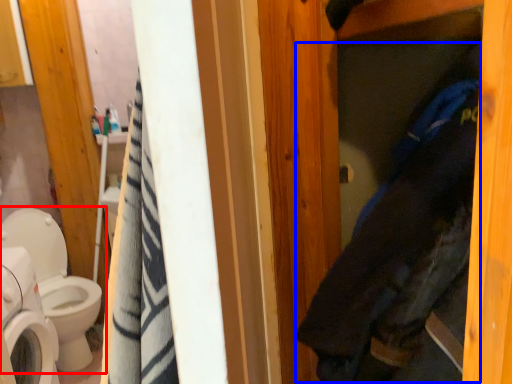
Question: Among these objects, which one is farthest to the camera, toilet (highlighted by a red box) or clothing (highlighted by a blue box)?

Choices:
 (A) toilet
 (B) clothing

Answer: (A)